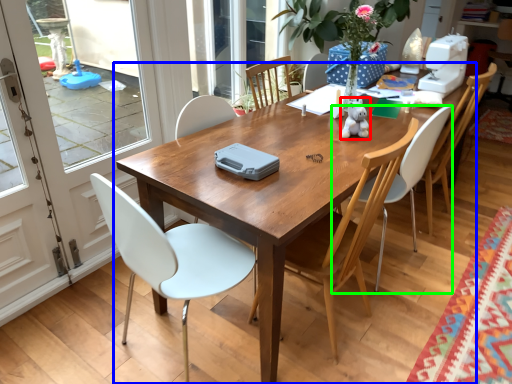
Question: Which object is the farthest from toy (highlighted by a red box)? Choose among these: kitchen & dining room table (highlighted by a blue box) or chair (highlighted by a green box).

Choices:
 (A) kitchen & dining room table
 (B) chair

Answer: (A)